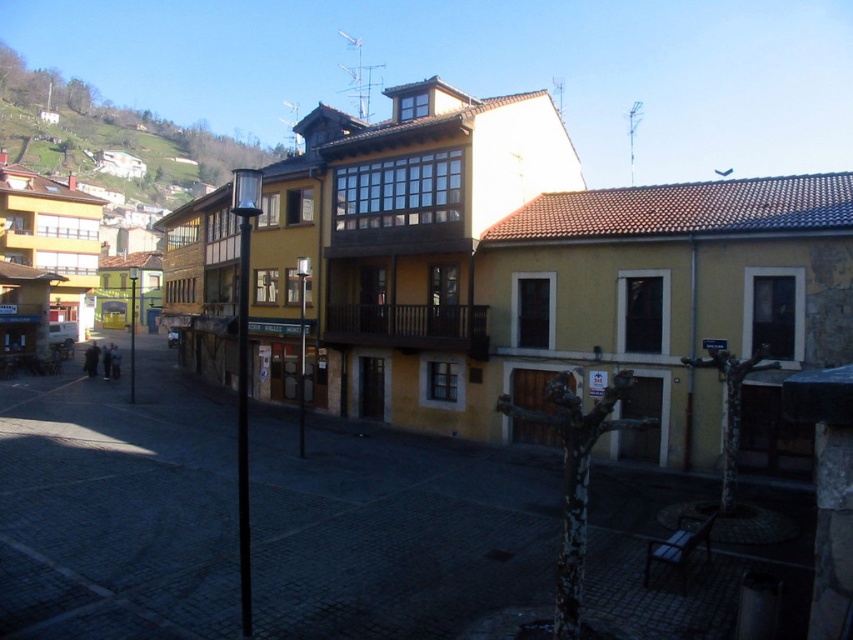
You are standing at the coordinates point 0.791, 0.138 in this urban street scene. Which object from the following list would you be directly facing? List of objects includes the yellow matte building at center.

The yellow matte building at center is located at point [117,509], so you would be directly facing the yellow matte building at center.

You are an architect analyzing the urban layout of this European town. Considering the yellow matte building at center and the green grassy hillside at upper left, which one occupies a larger area in the scene?

The green grassy hillside at upper left occupies a larger area in the scene compared to the yellow matte building at center, as the yellow matte building at center has a smaller size compared to green grassy hillside at upper left.